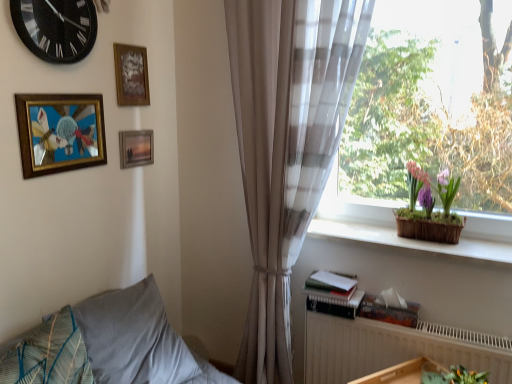
Question: Can you confirm if white textured radiator at lower right is smaller than gold-framed artwork at upper left, positioned as the first picture frame in front-to-back order?

Choices:
 (A) yes
 (B) no

Answer: (B)

Question: Considering the relative positions of white textured radiator at lower right and gold-framed artwork at upper left, which is the third picture frame in back-to-front order, in the image provided, is white textured radiator at lower right to the left of gold-framed artwork at upper left, which is the third picture frame in back-to-front order, from the viewer's perspective?

Choices:
 (A) yes
 (B) no

Answer: (B)

Question: Is white textured radiator at lower right oriented away from gold-framed artwork at upper left, positioned as the first picture frame in front-to-back order?

Choices:
 (A) no
 (B) yes

Answer: (A)

Question: From the image's perspective, is white textured radiator at lower right on top of gold-framed artwork at upper left, which is the third picture frame in back-to-front order?

Choices:
 (A) yes
 (B) no

Answer: (B)

Question: Is the depth of white textured radiator at lower right greater than that of gold-framed artwork at upper left, positioned as the first picture frame in front-to-back order?

Choices:
 (A) yes
 (B) no

Answer: (A)

Question: Considering the relative positions of translucent fabric at right and textured blue pillow at lower left, which is the 1th pillow in front-to-back order, in the image provided, is translucent fabric at right to the left or to the right of textured blue pillow at lower left, which is the 1th pillow in front-to-back order,?

Choices:
 (A) left
 (B) right

Answer: (B)

Question: From a real-world perspective, is translucent fabric at right above or below textured blue pillow at lower left, which is the 1th pillow in front-to-back order?

Choices:
 (A) below
 (B) above

Answer: (B)

Question: Is translucent fabric at right bigger or smaller than textured blue pillow at lower left, which is the 1th pillow in front-to-back order?

Choices:
 (A) small
 (B) big

Answer: (B)

Question: Is translucent fabric at right in front of or behind textured blue pillow at lower left, the 2th pillow in the back-to-front sequence, in the image?

Choices:
 (A) front
 (B) behind

Answer: (B)

Question: Considering their positions, is sheer beige curtain at right located in front of or behind gold-framed artwork at upper left, positioned as the first picture frame in front-to-back order?

Choices:
 (A) behind
 (B) front

Answer: (B)

Question: In terms of height, does sheer beige curtain at right look taller or shorter compared to gold-framed artwork at upper left, positioned as the first picture frame in front-to-back order?

Choices:
 (A) short
 (B) tall

Answer: (B)

Question: Is point (260, 104) positioned closer to the camera than point (57, 168)?

Choices:
 (A) closer
 (B) farther

Answer: (B)

Question: From the image's perspective, is sheer beige curtain at right positioned above or below gold-framed artwork at upper left, positioned as the first picture frame in front-to-back order?

Choices:
 (A) below
 (B) above

Answer: (A)

Question: In terms of height, does translucent fabric at right look taller or shorter compared to sheer beige curtain at right?

Choices:
 (A) short
 (B) tall

Answer: (A)

Question: Is translucent fabric at right situated inside sheer beige curtain at right or outside?

Choices:
 (A) inside
 (B) outside

Answer: (B)